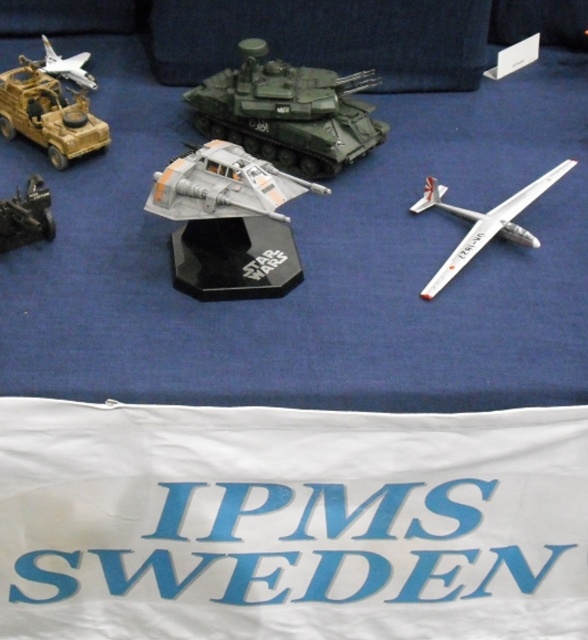
Question: Which point is farther to the camera?

Choices:
 (A) (472, 250)
 (B) (253, 138)

Answer: (B)

Question: Can you confirm if white glossy airplane at upper right is positioned to the right of white matte airplane at upper left?

Choices:
 (A) yes
 (B) no

Answer: (A)

Question: Is green matte tank at center to the left of white matte airplane at upper left from the viewer's perspective?

Choices:
 (A) yes
 (B) no

Answer: (B)

Question: Which point is farther to the camera?

Choices:
 (A) white matte airplane at upper left
 (B) green matte tank at center

Answer: (A)

Question: Can you confirm if green matte tank at center is positioned below white matte airplane at upper left?

Choices:
 (A) no
 (B) yes

Answer: (B)

Question: Among these objects, which one is nearest to the camera?

Choices:
 (A) white glossy airplane at upper right
 (B) metallic gray tank at lower left
 (C) matte brown military vehicle at left
 (D) green matte tank at center

Answer: (A)